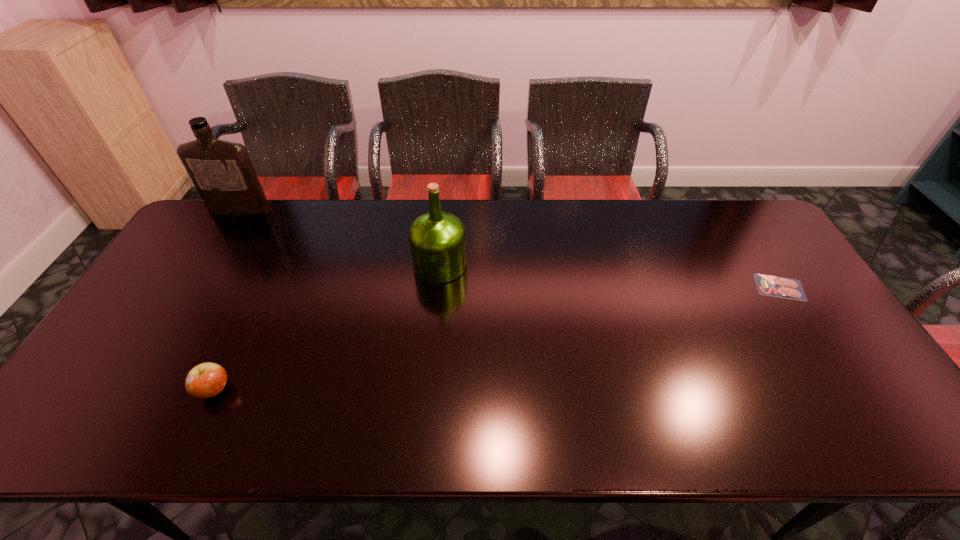
Locate an element on the screen. vacant point located between the liquor and the second shortest object is located at coordinates (228, 300).

This screenshot has height=540, width=960. What are the coordinates of `free space between the farthest object and the shortest object` in the screenshot? It's located at click(510, 249).

The image size is (960, 540). Find the location of `vacant space that's between the apple and the liquor`. vacant space that's between the apple and the liquor is located at coordinates (228, 300).

The image size is (960, 540). What are the coordinates of `vacant area that lies between the nearest object and the second object from right to left` in the screenshot? It's located at (327, 327).

Find the location of a particular element. This screenshot has width=960, height=540. vacant space that is in between the nearest object and the leftmost object is located at coordinates (228, 300).

The image size is (960, 540). In order to click on vacant space that's between the rightmost object and the farthest object in this screenshot , I will do point(510,249).

Where is `unoccupied position between the liquor and the nearest object`? Image resolution: width=960 pixels, height=540 pixels. unoccupied position between the liquor and the nearest object is located at coordinates coord(228,300).

Where is `free space between the farthest object and the salami`? free space between the farthest object and the salami is located at coordinates (510, 249).

This screenshot has width=960, height=540. In order to click on free area in between the farthest object and the third tallest object in this screenshot , I will do `click(228, 300)`.

Image resolution: width=960 pixels, height=540 pixels. Find the location of `the closest object to the second tallest object`. the closest object to the second tallest object is located at coordinates (206, 380).